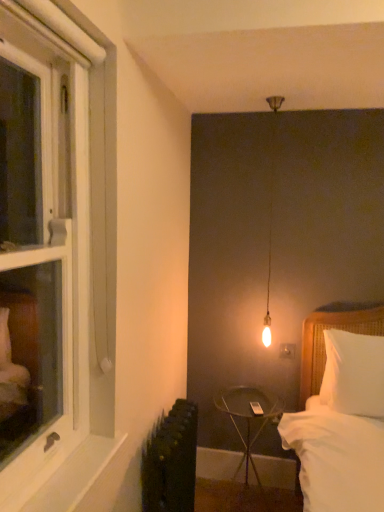
Question: Is metallic black side table at center in front of white painted wood at lower left?

Choices:
 (A) yes
 (B) no

Answer: (B)

Question: Considering the relative positions of metallic black side table at center and white painted wood at lower left in the image provided, is metallic black side table at center to the right of white painted wood at lower left from the viewer's perspective?

Choices:
 (A) yes
 (B) no

Answer: (A)

Question: Is metallic black side table at center positioned far away from white painted wood at lower left?

Choices:
 (A) no
 (B) yes

Answer: (B)

Question: From the image's perspective, is metallic black side table at center on top of white painted wood at lower left?

Choices:
 (A) yes
 (B) no

Answer: (B)

Question: Could you tell me if metallic black side table at center is facing white painted wood at lower left?

Choices:
 (A) yes
 (B) no

Answer: (A)

Question: In the image, is white wood window at left on the left side or the right side of white soft pillow at right?

Choices:
 (A) left
 (B) right

Answer: (A)

Question: Relative to white soft pillow at right, is white wood window at left in front or behind?

Choices:
 (A) front
 (B) behind

Answer: (A)

Question: Is white wood window at left bigger or smaller than white soft pillow at right?

Choices:
 (A) small
 (B) big

Answer: (B)

Question: Looking at their shapes, would you say white wood window at left is wider or thinner than white soft pillow at right?

Choices:
 (A) thin
 (B) wide

Answer: (B)

Question: Considering the positions of white painted wood at lower left and white wood window at left in the image, is white painted wood at lower left taller or shorter than white wood window at left?

Choices:
 (A) short
 (B) tall

Answer: (A)

Question: From a real-world perspective, is white painted wood at lower left positioned above or below white wood window at left?

Choices:
 (A) below
 (B) above

Answer: (A)

Question: Looking at the image, does white painted wood at lower left seem bigger or smaller compared to white wood window at left?

Choices:
 (A) big
 (B) small

Answer: (B)

Question: Considering the positions of point (66, 496) and point (26, 35), is point (66, 496) closer or farther from the camera than point (26, 35)?

Choices:
 (A) closer
 (B) farther

Answer: (B)

Question: Considering the positions of matte white outlet at center-right and white painted wood at lower left in the image, is matte white outlet at center-right wider or thinner than white painted wood at lower left?

Choices:
 (A) thin
 (B) wide

Answer: (A)

Question: Relative to white painted wood at lower left, is matte white outlet at center-right in front or behind?

Choices:
 (A) behind
 (B) front

Answer: (A)